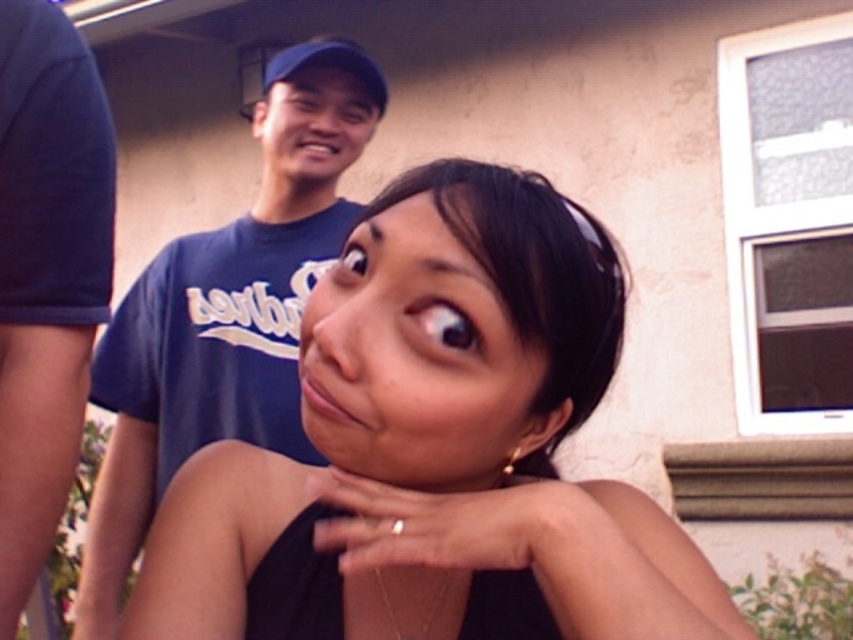
Question: Can you confirm if matte black tank top at center is thinner than matte blue cap at upper center?

Choices:
 (A) no
 (B) yes

Answer: (A)

Question: Estimate the real-world distances between objects in this image. Which object is farther from the dark blue fabric at center?

Choices:
 (A) matte black tank top at center
 (B) blue cotton t-shirt at upper center

Answer: (B)

Question: Can you confirm if dark blue fabric at center is thinner than smooth skin face at center?

Choices:
 (A) no
 (B) yes

Answer: (B)

Question: Does dark blue fabric at center have a smaller size compared to matte blue cap at upper center?

Choices:
 (A) yes
 (B) no

Answer: (A)

Question: Which point appears closest to the camera in this image?

Choices:
 (A) click(317, 410)
 (B) click(68, 220)
 (C) click(294, 132)
 (D) click(376, 314)

Answer: (A)

Question: Which object is farther from the camera taking this photo?

Choices:
 (A) blue cotton t-shirt at upper center
 (B) dark blue fabric at center

Answer: (A)